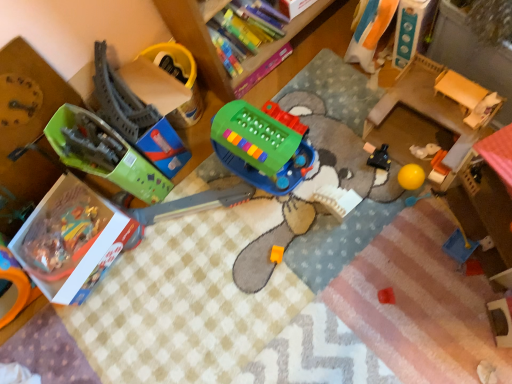
Find the location of `vacant point above green plastic toy at center, placed as the third toy when sorted from left to right (from a real-world perspective)`. vacant point above green plastic toy at center, placed as the third toy when sorted from left to right (from a real-world perspective) is located at coordinates (250, 140).